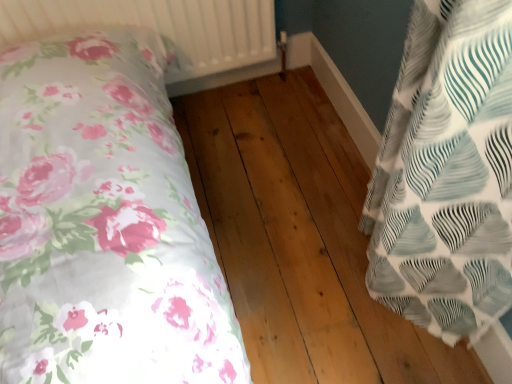
Question: Is white textured radiator at upper center beside white textured fabric pillow at right?

Choices:
 (A) yes
 (B) no

Answer: (B)

Question: Considering the relative positions of white textured radiator at upper center and white textured fabric pillow at right in the image provided, is white textured radiator at upper center to the right of white textured fabric pillow at right from the viewer's perspective?

Choices:
 (A) no
 (B) yes

Answer: (A)

Question: Considering the relative sizes of white textured radiator at upper center and white textured fabric pillow at right in the image provided, is white textured radiator at upper center taller than white textured fabric pillow at right?

Choices:
 (A) no
 (B) yes

Answer: (B)

Question: Is white textured radiator at upper center oriented towards white textured fabric pillow at right?

Choices:
 (A) no
 (B) yes

Answer: (B)

Question: Can you confirm if white textured radiator at upper center is bigger than white textured fabric pillow at right?

Choices:
 (A) yes
 (B) no

Answer: (A)

Question: Is white textured radiator at upper center taller or shorter than natural wood floor at center?

Choices:
 (A) tall
 (B) short

Answer: (A)

Question: Is white textured radiator at upper center bigger or smaller than natural wood floor at center?

Choices:
 (A) small
 (B) big

Answer: (A)

Question: Is white textured radiator at upper center inside the boundaries of natural wood floor at center, or outside?

Choices:
 (A) inside
 (B) outside

Answer: (B)

Question: In the image, is white textured radiator at upper center on the left side or the right side of natural wood floor at center?

Choices:
 (A) left
 (B) right

Answer: (A)

Question: From a real-world perspective, is white textured radiator at upper center above or below white textured fabric pillow at right?

Choices:
 (A) below
 (B) above

Answer: (B)

Question: Which is correct: white textured radiator at upper center is inside white textured fabric pillow at right, or outside of it?

Choices:
 (A) inside
 (B) outside

Answer: (B)

Question: Is white textured radiator at upper center wider or thinner than white textured fabric pillow at right?

Choices:
 (A) wide
 (B) thin

Answer: (A)

Question: From the image's perspective, is white textured radiator at upper center positioned above or below white textured fabric pillow at right?

Choices:
 (A) above
 (B) below

Answer: (A)

Question: Based on their sizes in the image, would you say natural wood floor at center is bigger or smaller than white textured fabric pillow at right?

Choices:
 (A) small
 (B) big

Answer: (B)

Question: Does point (221, 97) appear closer or farther from the camera than point (453, 155)?

Choices:
 (A) closer
 (B) farther

Answer: (B)